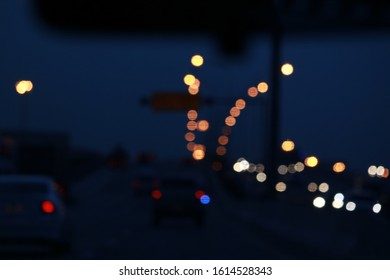
Find the location of a particular element. This screenshot has height=280, width=390. light is located at coordinates (376, 209).